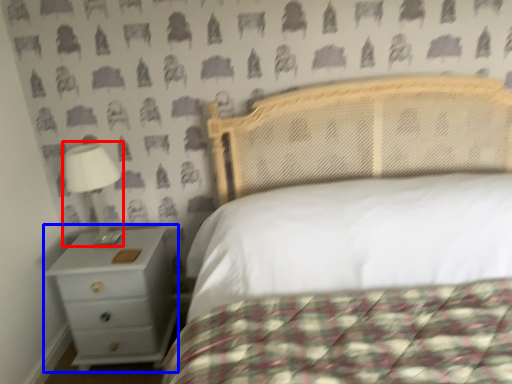
Question: Which object is closer to the camera taking this photo, lamp (highlighted by a red box) or nightstand (highlighted by a blue box)?

Choices:
 (A) lamp
 (B) nightstand

Answer: (A)